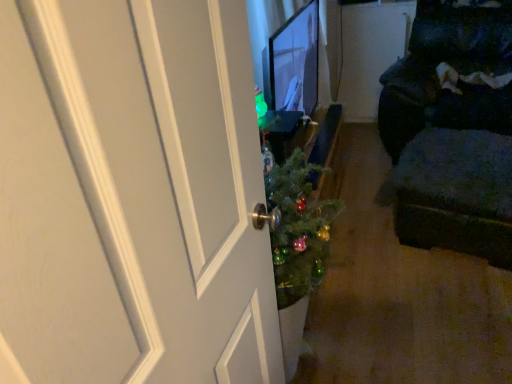
Find the location of a particular element. free spot in front of dark fabric ottoman at right is located at coordinates (452, 309).